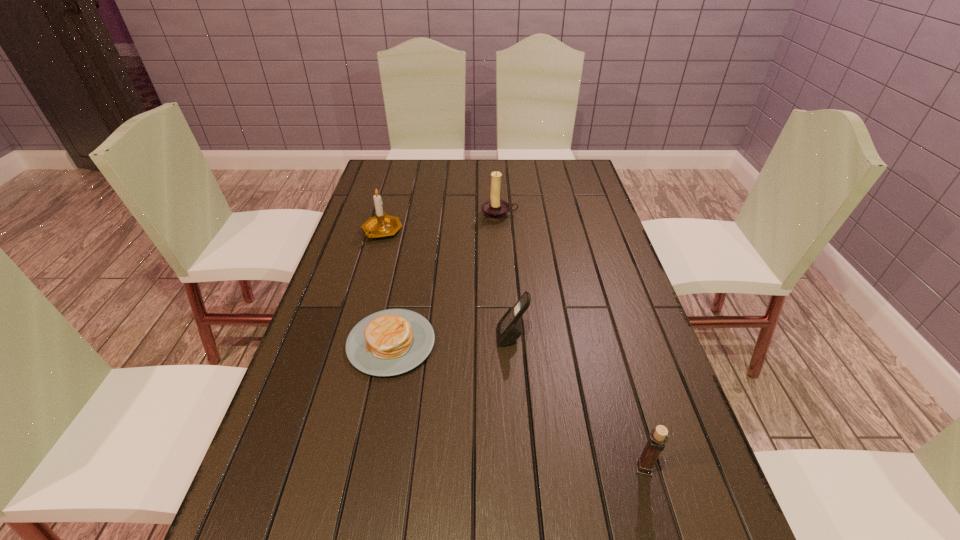
Find the location of `free location that satisfies the following two spatial constraints: 1. on the front-facing side of the cellular telephone; 2. on the left side of the nearest object`. free location that satisfies the following two spatial constraints: 1. on the front-facing side of the cellular telephone; 2. on the left side of the nearest object is located at coordinates (521, 468).

This screenshot has height=540, width=960. Find the location of `vacant space that satisfies the following two spatial constraints: 1. on the front-facing side of the cellular telephone; 2. on the front side of the shortest object`. vacant space that satisfies the following two spatial constraints: 1. on the front-facing side of the cellular telephone; 2. on the front side of the shortest object is located at coordinates (512, 343).

The height and width of the screenshot is (540, 960). In order to click on vacant region that satisfies the following two spatial constraints: 1. on the wick of the nearest object; 2. on the left side of the second candle holder from left to right in this screenshot , I will do `click(515, 468)`.